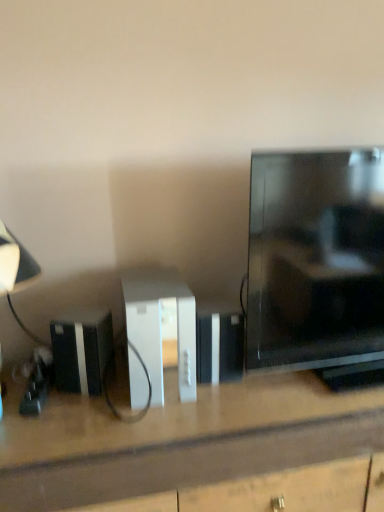
Locate an element on the screen. empty space that is to the right of black plastic speaker at lower left is located at coordinates (147, 408).